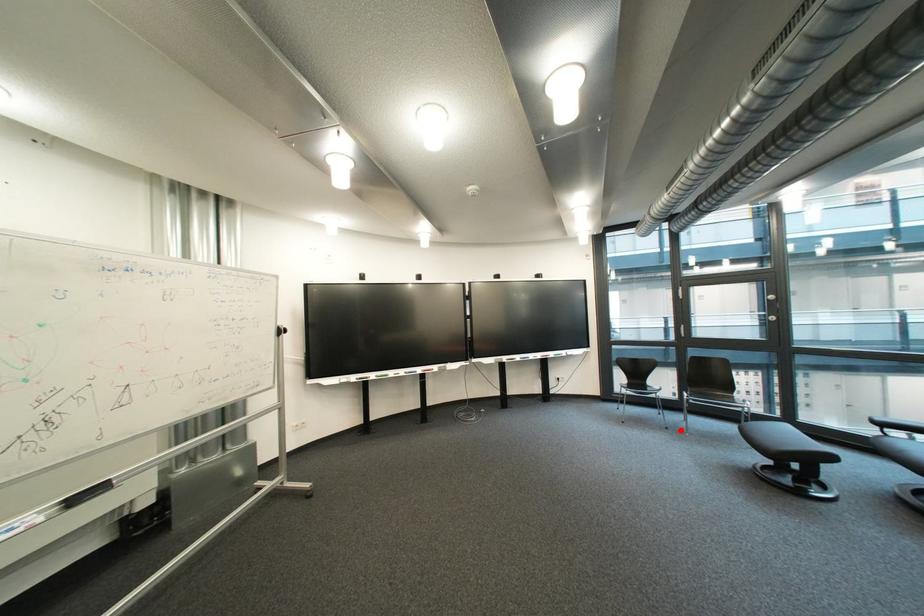
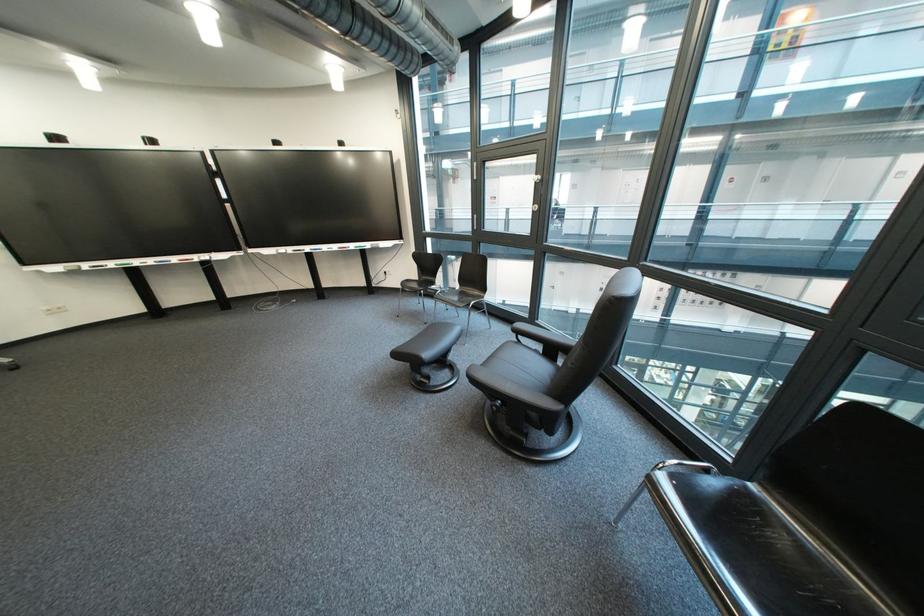
Where in the second image is the point corresponding to the highlighted location from the first image?

(439, 325)